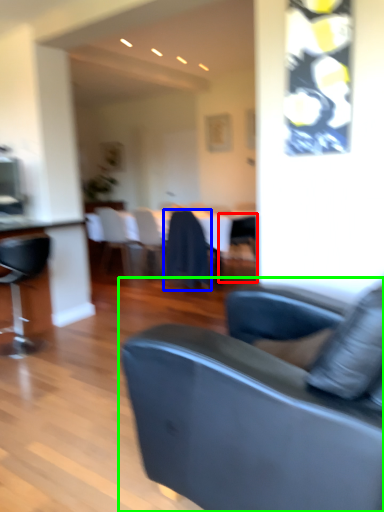
Question: Based on their relative distances, which object is farther from chair (highlighted by a red box)? Choose from chair (highlighted by a blue box) and studio couch (highlighted by a green box).

Choices:
 (A) chair
 (B) studio couch

Answer: (B)